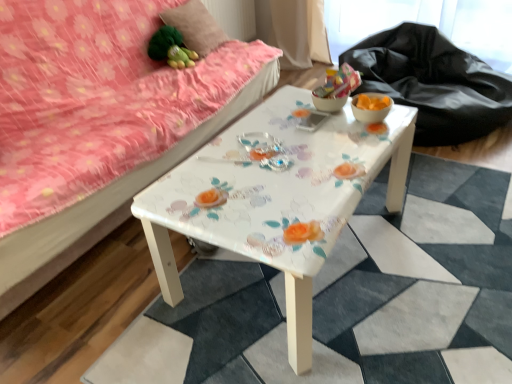
Question: Is green fabric toy at upper left at the right side of black fabric at upper right?

Choices:
 (A) no
 (B) yes

Answer: (A)

Question: Is green fabric toy at upper left positioned beyond the bounds of black fabric at upper right?

Choices:
 (A) yes
 (B) no

Answer: (A)

Question: From the image's perspective, is green fabric toy at upper left below black fabric at upper right?

Choices:
 (A) yes
 (B) no

Answer: (B)

Question: Does green fabric toy at upper left appear on the left side of black fabric at upper right?

Choices:
 (A) no
 (B) yes

Answer: (B)

Question: Can you confirm if green fabric toy at upper left is taller than black fabric at upper right?

Choices:
 (A) yes
 (B) no

Answer: (B)

Question: Is green fabric toy at upper left oriented towards black fabric at upper right?

Choices:
 (A) yes
 (B) no

Answer: (B)

Question: Is white glossy table at center positioned before black fabric at upper right?

Choices:
 (A) yes
 (B) no

Answer: (A)

Question: Does white glossy table at center have a greater width compared to black fabric at upper right?

Choices:
 (A) no
 (B) yes

Answer: (A)

Question: Can you confirm if white glossy table at center is shorter than black fabric at upper right?

Choices:
 (A) yes
 (B) no

Answer: (A)

Question: From the image's perspective, would you say white glossy table at center is positioned over black fabric at upper right?

Choices:
 (A) yes
 (B) no

Answer: (B)

Question: Could black fabric at upper right be considered to be inside white glossy table at center?

Choices:
 (A) yes
 (B) no

Answer: (B)

Question: Is white glossy table at center taller than black fabric at upper right?

Choices:
 (A) no
 (B) yes

Answer: (A)

Question: From a real-world perspective, is matte orange glass bowl at right, which is the 1th glass bowl from right to left, physically above fluffy pink pillow at upper left?

Choices:
 (A) no
 (B) yes

Answer: (A)